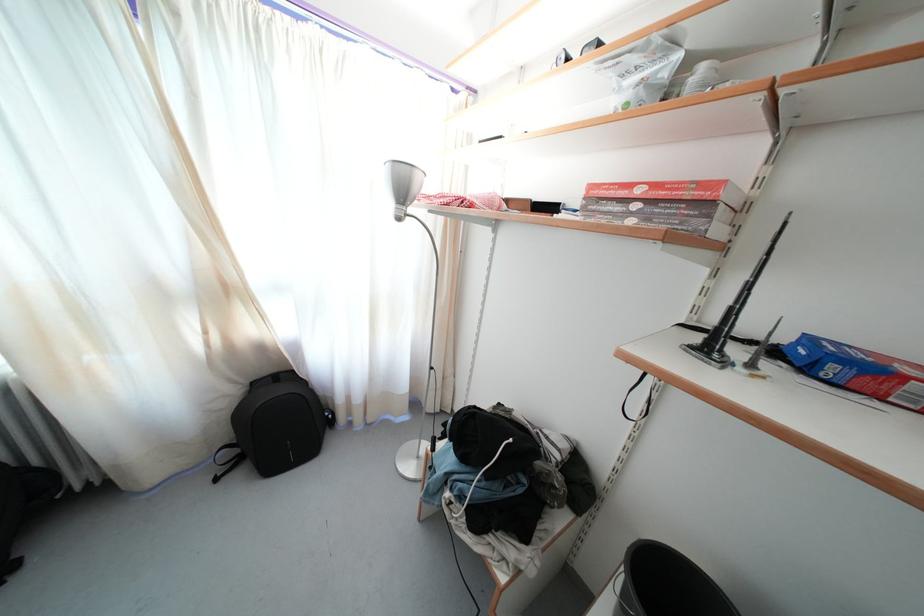
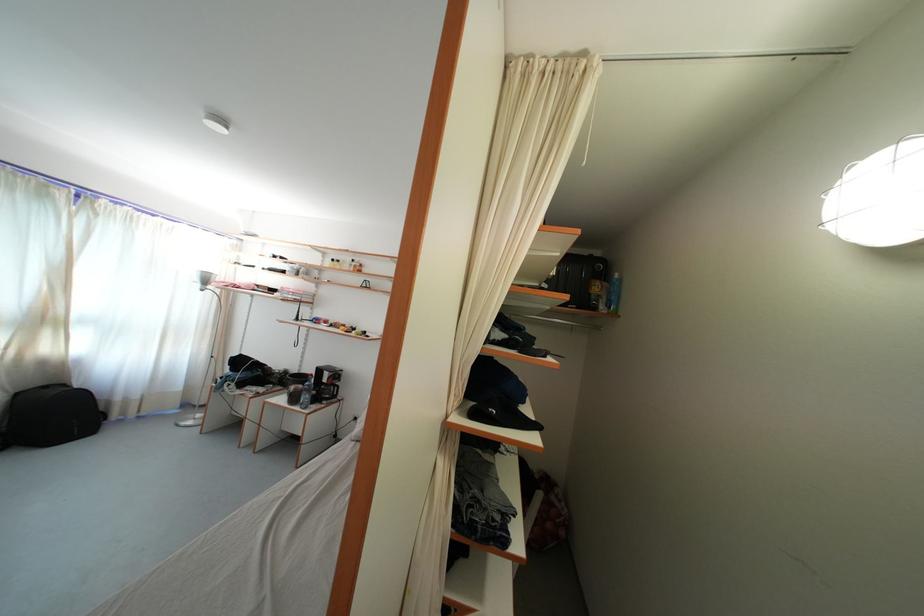
Locate, in the second image, the point that corresponds to point 259,390 in the first image.

(23, 400)